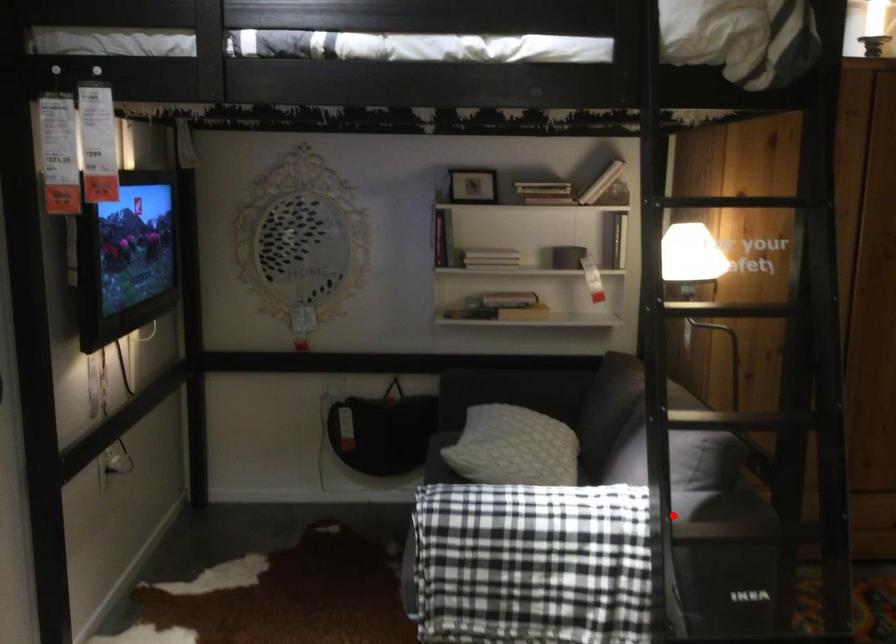
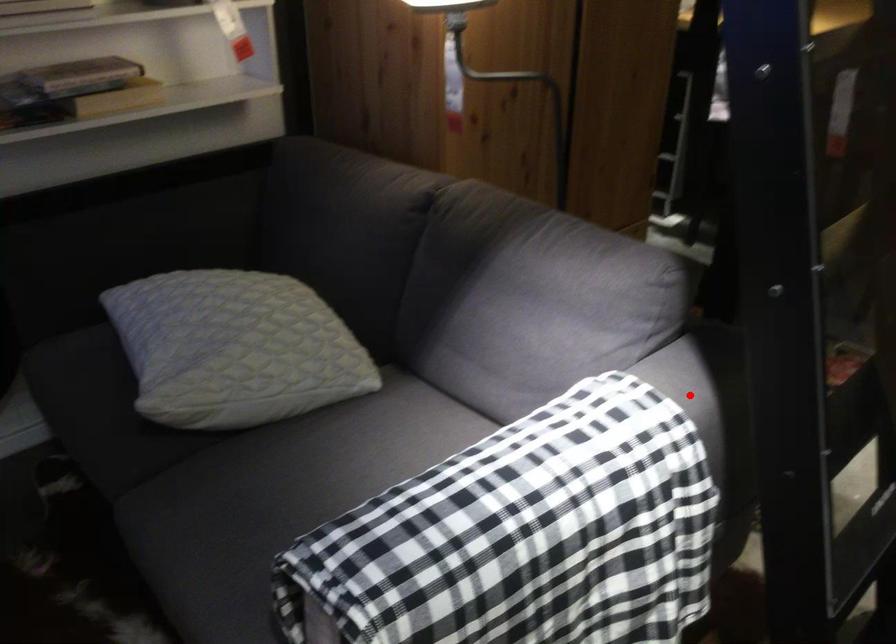
I am providing you with two images of the same scene from different viewpoints. A red point is marked on the first image and another point is marked on the second image. Are the points marked in image1 and image2 representing the same 3D position?

Yes